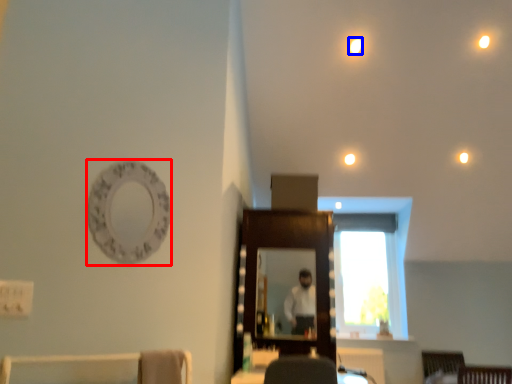
Question: Which of the following is the farthest to the observer, oval (highlighted by a red box) or lighting (highlighted by a blue box)?

Choices:
 (A) oval
 (B) lighting

Answer: (B)